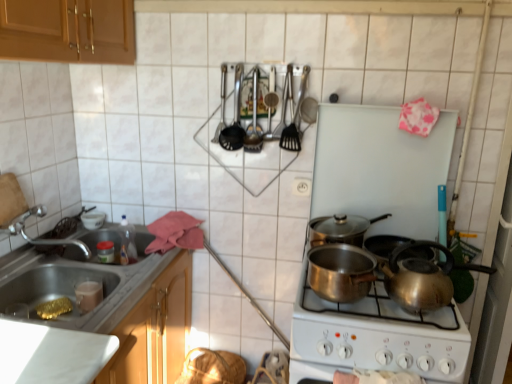
Locate an element on the screen. Image resolution: width=512 pixels, height=384 pixels. metallic cooking utensils at upper center is located at coordinates (234, 118).

Where is `metallic sink at lower left`? This screenshot has height=384, width=512. metallic sink at lower left is located at coordinates (78, 282).

Which is more to the left, white plastic socket at center or gold foil at lower left?

gold foil at lower left is more to the left.

Is white plastic socket at center not within gold foil at lower left?

white plastic socket at center is positioned outside gold foil at lower left.

In the image, is white plastic socket at center positioned in front of or behind gold foil at lower left?

A: In the image, white plastic socket at center appears behind gold foil at lower left.

Where is `electric outlet that appears behind the gold foil at lower left`? electric outlet that appears behind the gold foil at lower left is located at coordinates 301,186.

Is metallic cooking utensils at upper center oriented towards polished copper pot at center, the first kitchen appliance ordered from the bottom?

No.

Is point (243, 132) more distant than point (369, 288)?

Yes, point (243, 132) is behind point (369, 288).

Does metallic cooking utensils at upper center have a lesser width compared to polished copper pot at center, the first kitchen appliance ordered from the bottom?

Correct, the width of metallic cooking utensils at upper center is less than that of polished copper pot at center, the first kitchen appliance ordered from the bottom.

Where is `appliance to the left of polished copper pot at center, which ranks as the 2th kitchen appliance in top-to-bottom order`? appliance to the left of polished copper pot at center, which ranks as the 2th kitchen appliance in top-to-bottom order is located at coordinates (234, 118).

Is shiny silver pot at center, which is the 1th kitchen appliance in top-to-bottom order, completely or partially inside metallic sink at lower left?

Actually, shiny silver pot at center, which is the 1th kitchen appliance in top-to-bottom order, is outside metallic sink at lower left.

Which is more to the right, metallic sink at lower left or shiny silver pot at center, which is the second kitchen appliance in bottom-to-top order?

shiny silver pot at center, which is the second kitchen appliance in bottom-to-top order, is more to the right.

Are metallic sink at lower left and shiny silver pot at center, which is the 1th kitchen appliance in top-to-bottom order, beside each other?

No, metallic sink at lower left is not next to shiny silver pot at center, which is the 1th kitchen appliance in top-to-bottom order.

How different are the orientations of metallic sink at lower left and shiny silver pot at center, which is the 1th kitchen appliance in top-to-bottom order, in degrees?

There is a 89.1-degree angle between the facing directions of metallic sink at lower left and shiny silver pot at center, which is the 1th kitchen appliance in top-to-bottom order.

Which of these two, shiny silver pot at center, which is the second kitchen appliance in bottom-to-top order, or metallic sink at lower left, is bigger?

metallic sink at lower left is bigger.

Would you consider shiny silver pot at center, which is the 1th kitchen appliance in top-to-bottom order, to be distant from metallic sink at lower left?

No.

Is shiny silver pot at center, which is the 1th kitchen appliance in top-to-bottom order, further to camera compared to metallic sink at lower left?

Yes, it is.

From the image's perspective, is shiny silver pot at center, which is the 1th kitchen appliance in top-to-bottom order, above or below metallic sink at lower left?

From the image's perspective, shiny silver pot at center, which is the 1th kitchen appliance in top-to-bottom order, appears above metallic sink at lower left.

Is white plastic socket at center beside metallic cooking utensils at upper center?

white plastic socket at center and metallic cooking utensils at upper center are not in contact.

In the image, is white plastic socket at center positioned in front of or behind metallic cooking utensils at upper center?

Visually, white plastic socket at center is located behind metallic cooking utensils at upper center.

Considering the relative sizes of white plastic socket at center and metallic cooking utensils at upper center in the image provided, is white plastic socket at center thinner than metallic cooking utensils at upper center?

Indeed, white plastic socket at center has a lesser width compared to metallic cooking utensils at upper center.

Could you tell me if white plastic socket at center is facing metallic cooking utensils at upper center?

No, white plastic socket at center is not facing towards metallic cooking utensils at upper center.

From the picture: From the image's perspective, who appears lower, metallic cooking utensils at upper center or gold foil at lower left?

gold foil at lower left.

Who is taller, metallic cooking utensils at upper center or gold foil at lower left?

metallic cooking utensils at upper center.

How far apart are metallic cooking utensils at upper center and gold foil at lower left?

metallic cooking utensils at upper center and gold foil at lower left are 36.17 inches apart.

Does metallic sink at lower left have a lesser width compared to metallic cooking utensils at upper center?

No.

From the image's perspective, which one is positioned higher, metallic sink at lower left or metallic cooking utensils at upper center?

metallic cooking utensils at upper center is shown above in the image.

Which is more to the left, metallic sink at lower left or metallic cooking utensils at upper center?

Positioned to the left is metallic sink at lower left.

Is metallic sink at lower left inside the boundaries of metallic cooking utensils at upper center, or outside?

metallic sink at lower left is spatially situated outside metallic cooking utensils at upper center.

Identify the location of electric outlet above the gold foil at lower left (from the image's perspective). Image resolution: width=512 pixels, height=384 pixels. (301, 186).

What are the coordinates of `the 2nd kitchen appliance directly beneath the metallic cooking utensils at upper center (from a real-world perspective)` in the screenshot? It's located at (340, 272).

Looking at the image, which one is located further to metallic sink at lower left, polished copper pot at center, which ranks as the 2th kitchen appliance in top-to-bottom order, or white plastic socket at center?

white plastic socket at center lies further to metallic sink at lower left than the other object.

When comparing their distances from metallic cooking utensils at upper center, does gold foil at lower left or polished copper pot at center, which ranks as the 2th kitchen appliance in top-to-bottom order, seem closer?

polished copper pot at center, which ranks as the 2th kitchen appliance in top-to-bottom order, is closer to metallic cooking utensils at upper center.

Based on their spatial positions, is polished stainless steel utensils at upper center or polished copper pot at center, which ranks as the 2th kitchen appliance in top-to-bottom order, closer to satin silver kettle at lower right?

Among the two, polished copper pot at center, which ranks as the 2th kitchen appliance in top-to-bottom order, is located nearer to satin silver kettle at lower right.

When comparing their distances from gold foil at lower left, does polished stainless steel utensils at upper center or satin silver kettle at lower right seem further?

polished stainless steel utensils at upper center lies further to gold foil at lower left than the other object.

Based on their spatial positions, is polished stainless steel utensils at upper center or polished copper pot at center, the first kitchen appliance ordered from the bottom, further from gold foil at lower left?

polished stainless steel utensils at upper center.

Looking at the image, which one is located closer to metallic sink at lower left, gold foil at lower left or white plastic socket at center?

The object closer to metallic sink at lower left is gold foil at lower left.

Which object lies nearer to the anchor point gold foil at lower left, white plastic socket at center or shiny silver pot at center, which is the 1th kitchen appliance in top-to-bottom order?

Among the two, white plastic socket at center is located nearer to gold foil at lower left.

Consider the image. When comparing their distances from polished copper pot at center, which ranks as the 2th kitchen appliance in top-to-bottom order, does metallic sink at lower left or metallic cooking utensils at upper center seem closer?

Based on the image, metallic cooking utensils at upper center appears to be nearer to polished copper pot at center, which ranks as the 2th kitchen appliance in top-to-bottom order.

Locate an element on the screen. electric outlet between gold foil at lower left and polished copper pot at center, the first kitchen appliance ordered from the bottom, in the horizontal direction is located at coordinates (301, 186).

This screenshot has width=512, height=384. In order to click on sink located between gold foil at lower left and shiny silver pot at center, which is the second kitchen appliance in bottom-to-top order, in the left-right direction in this screenshot , I will do `click(78, 282)`.

Locate an element on the screen. silverware between metallic cooking utensils at upper center and metallic sink at lower left in the up-down direction is located at coordinates (295, 119).

At what (x,y) coordinates should I click in order to perform the action: click on silverware between metallic cooking utensils at upper center and satin silver kettle at lower right vertically. Please return your answer as a coordinate pair (x, y). Image resolution: width=512 pixels, height=384 pixels. Looking at the image, I should click on (295, 119).